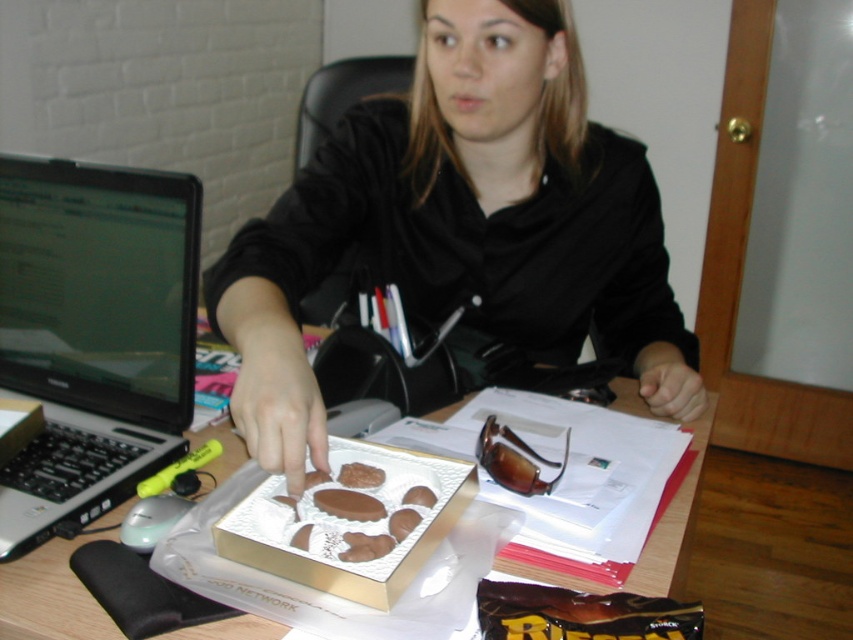
Question: Is wooden table at center smaller than chocolate-coated cookie at center?

Choices:
 (A) no
 (B) yes

Answer: (A)

Question: Which of the following is the farthest from the observer?

Choices:
 (A) chocolate matte at center
 (B) chocolate-coated cookie at center
 (C) black matte shirt at center
 (D) silver/black plastic laptop at left

Answer: (B)

Question: Can you confirm if gold foil box at center is wider than chocolate matte at center?

Choices:
 (A) yes
 (B) no

Answer: (A)

Question: Which object appears farthest from the camera in this image?

Choices:
 (A) silver/black plastic laptop at left
 (B) chocolate-coated candy at center
 (C) wooden table at center

Answer: (A)

Question: Is silver/black plastic laptop at left below wooden table at center?

Choices:
 (A) yes
 (B) no

Answer: (B)

Question: Which object appears closest to the camera in this image?

Choices:
 (A) gold foil box at center
 (B) chocolate matte at center
 (C) silver/black plastic laptop at left

Answer: (A)